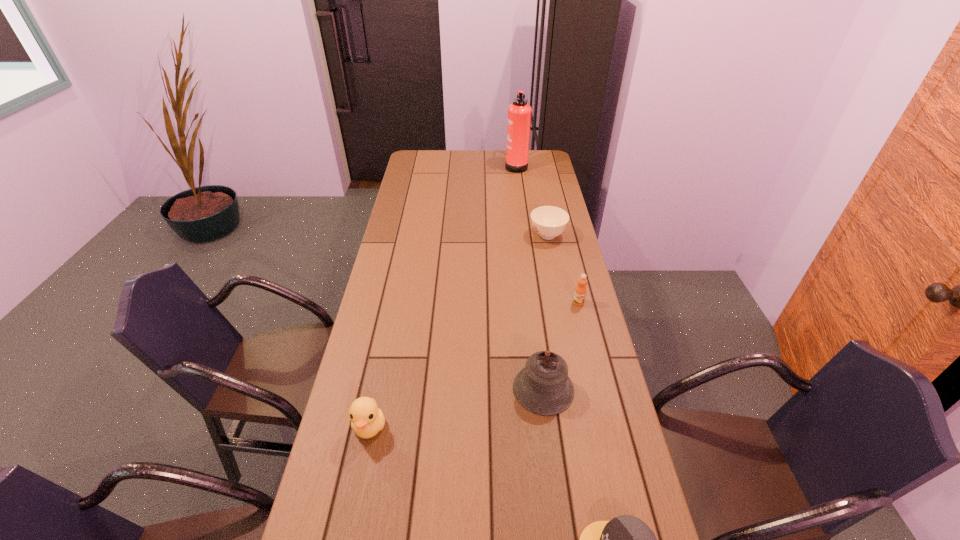
Where is `object that is at the far right corner`? This screenshot has height=540, width=960. object that is at the far right corner is located at coordinates (519, 113).

The height and width of the screenshot is (540, 960). I want to click on vacant space at the far edge of the desktop, so click(486, 160).

Where is `free space at the left edge`? free space at the left edge is located at coordinates (430, 197).

In the image, there is a desktop. Identify the location of free space at the right edge. Image resolution: width=960 pixels, height=540 pixels. (558, 247).

Find the location of a particular element. The image size is (960, 540). free region at the far left corner is located at coordinates (436, 170).

The height and width of the screenshot is (540, 960). In order to click on free space between the duck and the fifth tallest object in this screenshot , I will do `click(459, 331)`.

Where is `vacant area between the farthest object and the duck`? Image resolution: width=960 pixels, height=540 pixels. vacant area between the farthest object and the duck is located at coordinates (443, 296).

Image resolution: width=960 pixels, height=540 pixels. In order to click on empty space that is in between the second tallest object and the second shortest object in this screenshot , I will do `click(545, 312)`.

Locate an element on the screen. The width and height of the screenshot is (960, 540). vacant region between the bell and the fire extinguisher is located at coordinates (530, 277).

This screenshot has height=540, width=960. Find the location of `blank region between the leftmost object and the bell`. blank region between the leftmost object and the bell is located at coordinates (457, 408).